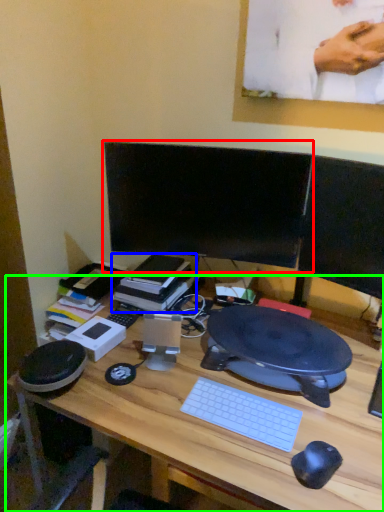
Question: Considering the real-world distances, which object is closest to computer monitor (highlighted by a red box)? book (highlighted by a blue box) or desk (highlighted by a green box).

Choices:
 (A) book
 (B) desk

Answer: (A)